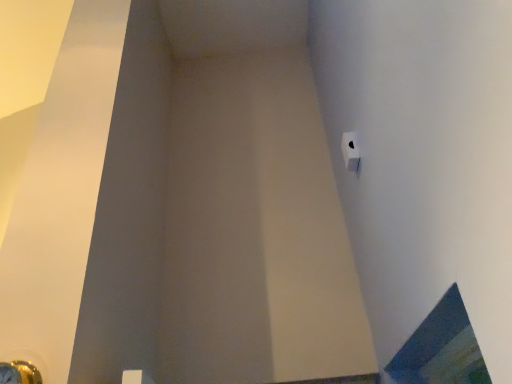
Question: Is metallic gold door handle at lower left to the right of white matte toilet paper at upper right from the viewer's perspective?

Choices:
 (A) yes
 (B) no

Answer: (B)

Question: From a real-world perspective, does metallic gold door handle at lower left stand above white matte toilet paper at upper right?

Choices:
 (A) no
 (B) yes

Answer: (A)

Question: Is metallic gold door handle at lower left wider than white matte toilet paper at upper right?

Choices:
 (A) no
 (B) yes

Answer: (B)

Question: From the image's perspective, is metallic gold door handle at lower left below white matte toilet paper at upper right?

Choices:
 (A) no
 (B) yes

Answer: (B)

Question: Can you confirm if metallic gold door handle at lower left is thinner than white matte toilet paper at upper right?

Choices:
 (A) yes
 (B) no

Answer: (B)

Question: Could white matte toilet paper at upper right be considered to be inside metallic gold door handle at lower left?

Choices:
 (A) no
 (B) yes

Answer: (A)

Question: Is blue glass window at lower right positioned in front of white matte toilet paper at upper right?

Choices:
 (A) yes
 (B) no

Answer: (A)

Question: Can you see blue glass window at lower right touching white matte toilet paper at upper right?

Choices:
 (A) yes
 (B) no

Answer: (B)

Question: Is there a large distance between blue glass window at lower right and white matte toilet paper at upper right?

Choices:
 (A) yes
 (B) no

Answer: (B)

Question: From the image's perspective, is blue glass window at lower right over white matte toilet paper at upper right?

Choices:
 (A) yes
 (B) no

Answer: (B)

Question: Is blue glass window at lower right aimed at white matte toilet paper at upper right?

Choices:
 (A) yes
 (B) no

Answer: (B)

Question: Is blue glass window at lower right smaller than white matte toilet paper at upper right?

Choices:
 (A) yes
 (B) no

Answer: (B)

Question: Considering the relative sizes of white matte toilet paper at upper right and blue glass window at lower right in the image provided, is white matte toilet paper at upper right smaller than blue glass window at lower right?

Choices:
 (A) no
 (B) yes

Answer: (B)